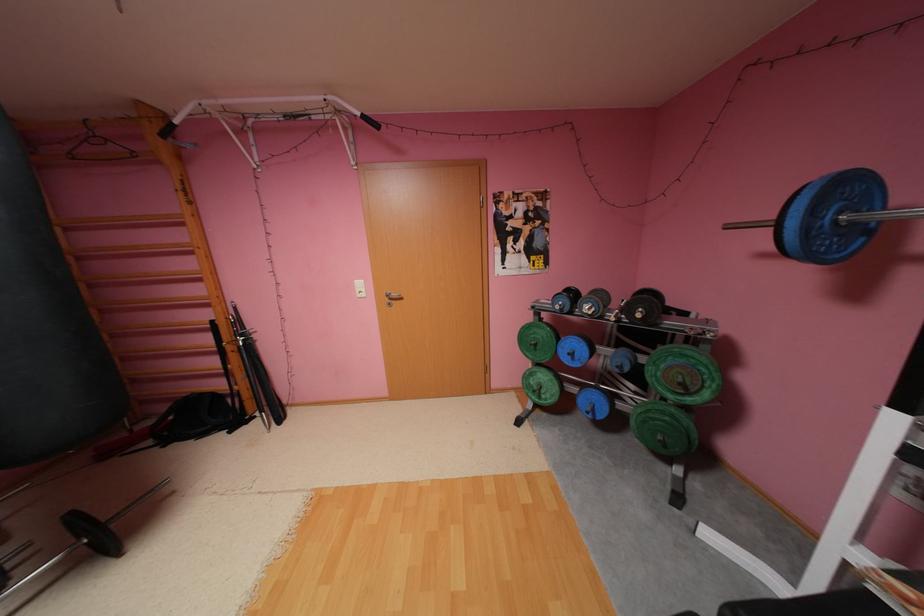
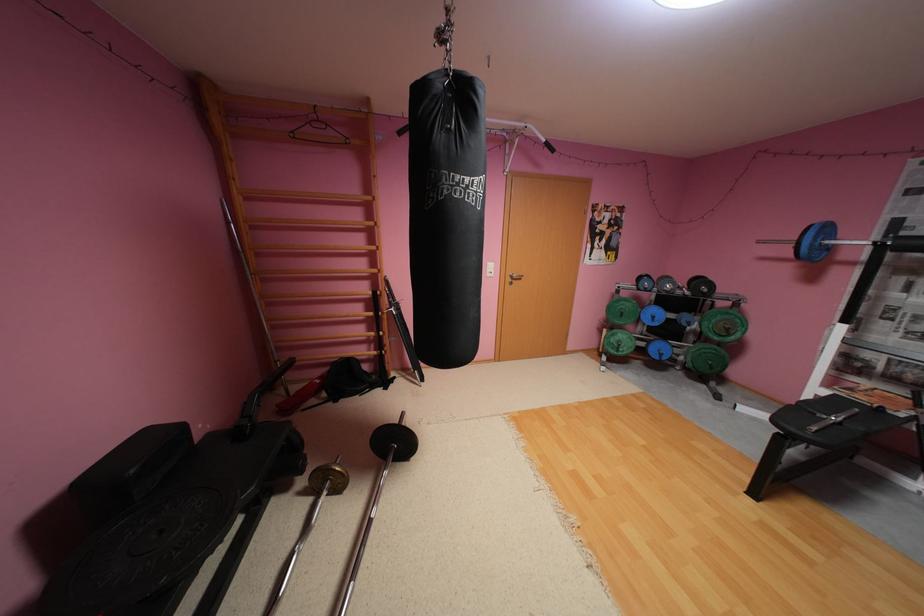
The point at (x=855, y=188) is marked in the first image. Where is the corresponding point in the second image?

(835, 229)